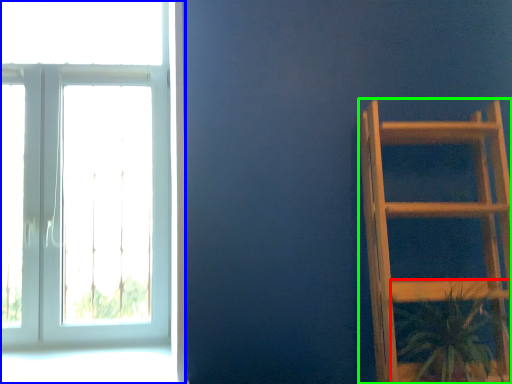
Question: Which is farther away from houseplant (highlighted by a red box)? window (highlighted by a blue box) or furniture (highlighted by a green box)?

Choices:
 (A) window
 (B) furniture

Answer: (A)